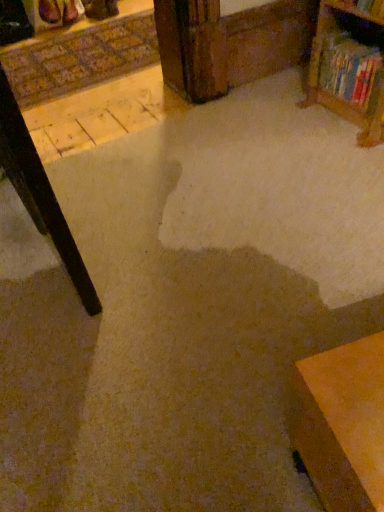
Question: Can hardcover book at upper right be found inside wooden bookshelf at upper right?

Choices:
 (A) no
 (B) yes

Answer: (A)

Question: From a real-world perspective, is wooden bookshelf at upper right physically below hardcover book at upper right?

Choices:
 (A) no
 (B) yes

Answer: (A)

Question: Is wooden bookshelf at upper right thinner than hardcover book at upper right?

Choices:
 (A) no
 (B) yes

Answer: (B)

Question: Is wooden bookshelf at upper right closer to the viewer compared to hardcover book at upper right?

Choices:
 (A) yes
 (B) no

Answer: (A)

Question: Does wooden bookshelf at upper right have a smaller size compared to hardcover book at upper right?

Choices:
 (A) no
 (B) yes

Answer: (B)

Question: Is wooden bookshelf at upper right not close to hardcover book at upper right?

Choices:
 (A) no
 (B) yes

Answer: (A)

Question: Does hardcover book at upper right appear on the right side of wooden bookshelf at upper right?

Choices:
 (A) no
 (B) yes

Answer: (B)

Question: From a real-world perspective, is hardcover book at upper right on top of wooden bookshelf at upper right?

Choices:
 (A) no
 (B) yes

Answer: (A)

Question: Can you confirm if hardcover book at upper right is bigger than wooden bookshelf at upper right?

Choices:
 (A) yes
 (B) no

Answer: (A)

Question: Considering the relative sizes of hardcover book at upper right and wooden bookshelf at upper right in the image provided, is hardcover book at upper right wider than wooden bookshelf at upper right?

Choices:
 (A) no
 (B) yes

Answer: (B)

Question: Does hardcover book at upper right have a smaller size compared to wooden bookshelf at upper right?

Choices:
 (A) yes
 (B) no

Answer: (B)

Question: Is the position of hardcover book at upper right more distant than that of wooden bookshelf at upper right?

Choices:
 (A) yes
 (B) no

Answer: (A)

Question: Considering the positions of hardcover book at upper right and wooden bookshelf at upper right in the image, is hardcover book at upper right bigger or smaller than wooden bookshelf at upper right?

Choices:
 (A) big
 (B) small

Answer: (A)